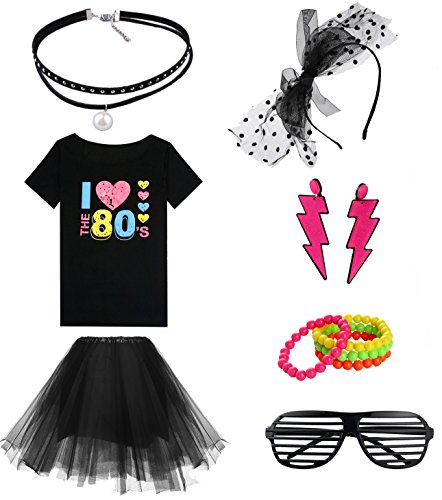
Identify the location of shades. The image size is (442, 500). (334, 436).